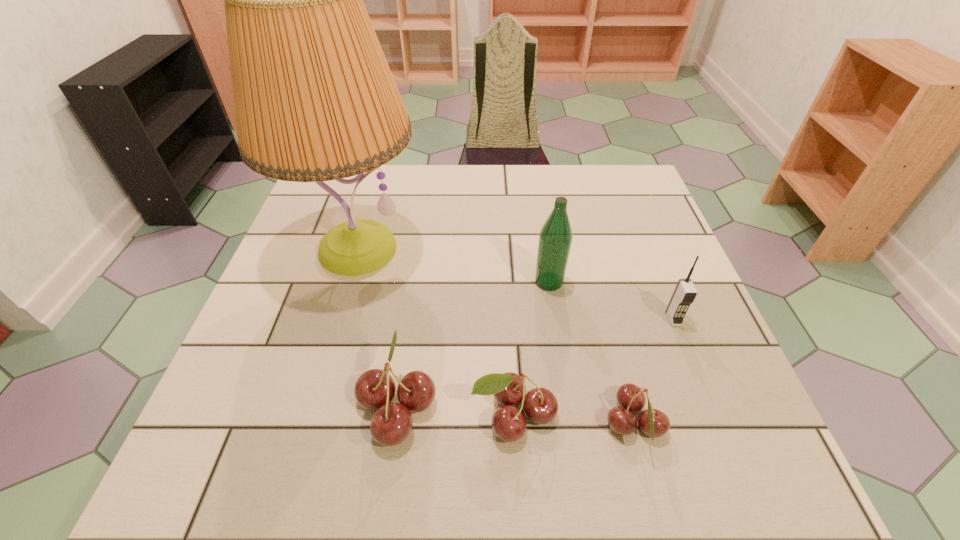
Identify the location of the closest cherry to the fifth tallest object. The height and width of the screenshot is (540, 960). (392, 422).

Identify the location of free spot that satisfies the following two spatial constraints: 1. on the front-facing side of the cellular telephone; 2. on the leaves of the fifth object from left to right. (715, 424).

At what (x,y) coordinates should I click in order to perform the action: click on blank area in the image that satisfies the following two spatial constraints: 1. on the front-facing side of the rightmost object; 2. on the leaves of the shortest cherry. Please return your answer as a coordinate pair (x, y). Looking at the image, I should click on (715, 424).